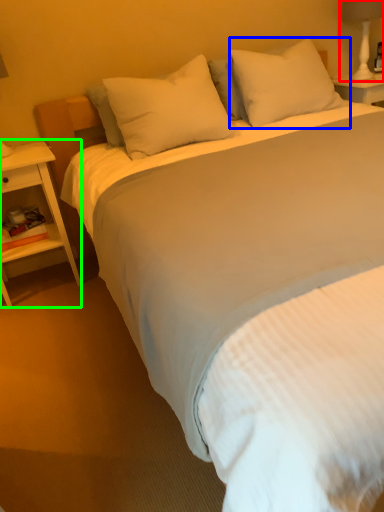
Question: Which is nearer to the bedside lamp (highlighted by a red box)? pillow (highlighted by a blue box) or nightstand (highlighted by a green box).

Choices:
 (A) pillow
 (B) nightstand

Answer: (A)